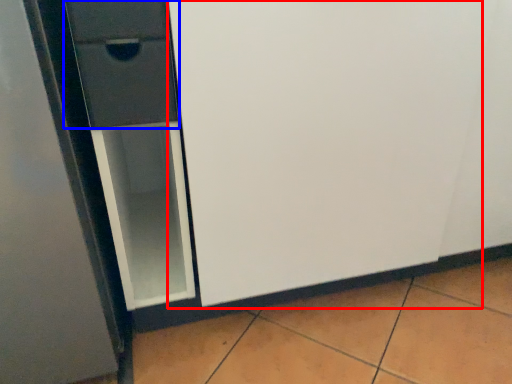
Question: Which object appears farthest to the camera in this image, screen door (highlighted by a red box) or drawer (highlighted by a blue box)?

Choices:
 (A) screen door
 (B) drawer

Answer: (B)